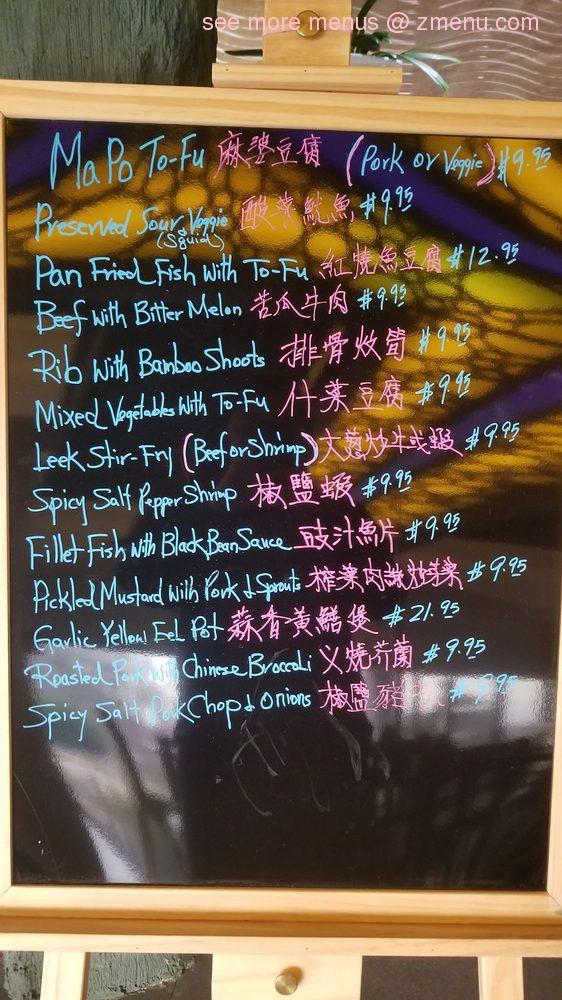
Locate an element on the screen. empty space next to knob is located at coordinates (244, 982).